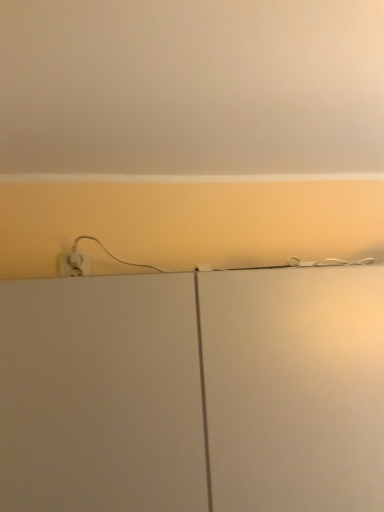
Question: From a real-world perspective, is white matte cabinet at center on matte white wall at upper center?

Choices:
 (A) yes
 (B) no

Answer: (B)

Question: Considering the relative sizes of white matte cabinet at center and matte white wall at upper center in the image provided, is white matte cabinet at center wider than matte white wall at upper center?

Choices:
 (A) yes
 (B) no

Answer: (B)

Question: From a real-world perspective, is white matte cabinet at center below matte white wall at upper center?

Choices:
 (A) yes
 (B) no

Answer: (A)

Question: Would you say white matte cabinet at center contains matte white wall at upper center?

Choices:
 (A) yes
 (B) no

Answer: (B)

Question: Is white matte cabinet at center turned away from matte white wall at upper center?

Choices:
 (A) yes
 (B) no

Answer: (B)

Question: Does white matte cabinet at center appear on the right side of matte white wall at upper center?

Choices:
 (A) yes
 (B) no

Answer: (B)

Question: Can you confirm if matte white wall at upper center is positioned to the right of white matte cabinet at center?

Choices:
 (A) no
 (B) yes

Answer: (B)

Question: Is matte white wall at upper center with white matte cabinet at center?

Choices:
 (A) yes
 (B) no

Answer: (B)

Question: Is white matte cabinet at center at the back of matte white wall at upper center?

Choices:
 (A) no
 (B) yes

Answer: (A)

Question: From the image's perspective, is matte white wall at upper center located above white matte cabinet at center?

Choices:
 (A) yes
 (B) no

Answer: (A)

Question: Is matte white wall at upper center behind white matte cabinet at center?

Choices:
 (A) no
 (B) yes

Answer: (A)

Question: Considering the relative sizes of matte white wall at upper center and white matte cabinet at center in the image provided, is matte white wall at upper center bigger than white matte cabinet at center?

Choices:
 (A) no
 (B) yes

Answer: (A)

Question: Is point (96, 76) closer or farther from the camera than point (182, 330)?

Choices:
 (A) farther
 (B) closer

Answer: (B)